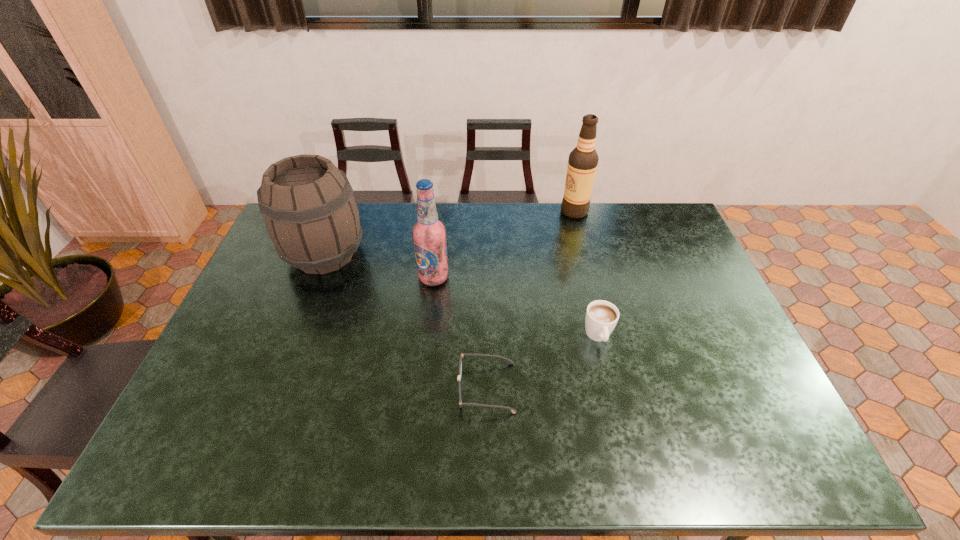
Locate an element on the screen. This screenshot has height=540, width=960. object that is positioned at the left edge is located at coordinates (311, 216).

What are the coordinates of `object present at the far left corner` in the screenshot? It's located at (311, 216).

Find the location of a particular element. The height and width of the screenshot is (540, 960). free spot at the far edge of the desktop is located at coordinates (398, 206).

This screenshot has height=540, width=960. Find the location of `vacant space at the left edge`. vacant space at the left edge is located at coordinates (257, 332).

Where is `free region at the right edge`? free region at the right edge is located at coordinates (671, 256).

Where is `vacant space at the near left corner`? This screenshot has width=960, height=540. vacant space at the near left corner is located at coordinates (x=208, y=443).

You are a GUI agent. You are given a task and a screenshot of the screen. Output one action in this format:
    pyautogui.click(x=<x>, y=<y>)
    Task: Click on the vacant space at the far right corner of the desktop
    This screenshot has width=960, height=540.
    Given the screenshot: What is the action you would take?
    pyautogui.click(x=657, y=233)

Find the location of a particular element. Image resolution: width=960 pixels, height=540 pixels. free point between the wine bucket and the spectacles is located at coordinates coord(405,321).

Where is `free space that is in between the second object from left to right and the farther alcohol`? This screenshot has width=960, height=540. free space that is in between the second object from left to right and the farther alcohol is located at coordinates (504, 245).

At what (x,y) coordinates should I click in order to perform the action: click on vacant area that lies between the farther alcohol and the leftmost object. Please return your answer as a coordinate pair (x, y). The width and height of the screenshot is (960, 540). Looking at the image, I should click on (449, 233).